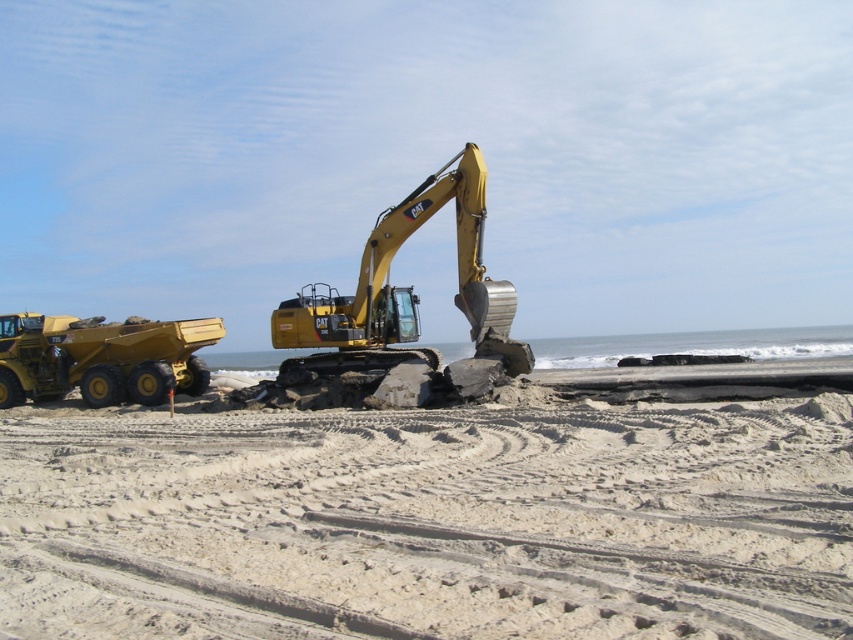
Is yellow metallic excavator at center wider than matte yellow dump truck at left?

No.

Can you confirm if yellow metallic excavator at center is positioned to the left of matte yellow dump truck at left?

Incorrect, yellow metallic excavator at center is not on the left side of matte yellow dump truck at left.

This screenshot has width=853, height=640. Identify the location of yellow metallic excavator at center. (408, 296).

This screenshot has height=640, width=853. I want to click on yellow metallic excavator at center, so click(x=408, y=296).

Does white sandy beach at center have a greater width compared to yellow metallic excavator at center?

Yes, white sandy beach at center is wider than yellow metallic excavator at center.

Can you confirm if white sandy beach at center is taller than yellow metallic excavator at center?

Incorrect, white sandy beach at center's height is not larger of yellow metallic excavator at center's.

Does point (757, 536) lie in front of point (358, 301)?

Yes, it is in front of point (358, 301).

Locate an element on the screen. Image resolution: width=853 pixels, height=640 pixels. white sandy beach at center is located at coordinates (430, 522).

Does white sandy beach at center have a greater height compared to matte yellow dump truck at left?

In fact, white sandy beach at center may be shorter than matte yellow dump truck at left.

Which is below, white sandy beach at center or matte yellow dump truck at left?

white sandy beach at center is lower down.

Does point (567, 540) come closer to viewer compared to point (44, 364)?

Yes, point (567, 540) is in front of point (44, 364).

You are a GUI agent. You are given a task and a screenshot of the screen. Output one action in this format:
    pyautogui.click(x=<x>, y=<y>)
    Task: Click on the white sandy beach at center
    The width and height of the screenshot is (853, 640).
    Given the screenshot: What is the action you would take?
    pyautogui.click(x=430, y=522)